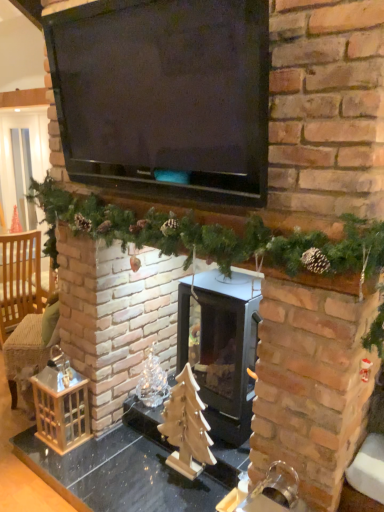
This screenshot has height=512, width=384. What are the coordinates of `vacant space in green garland at center (from a real-world perspective)` in the screenshot? It's located at [x=122, y=461].